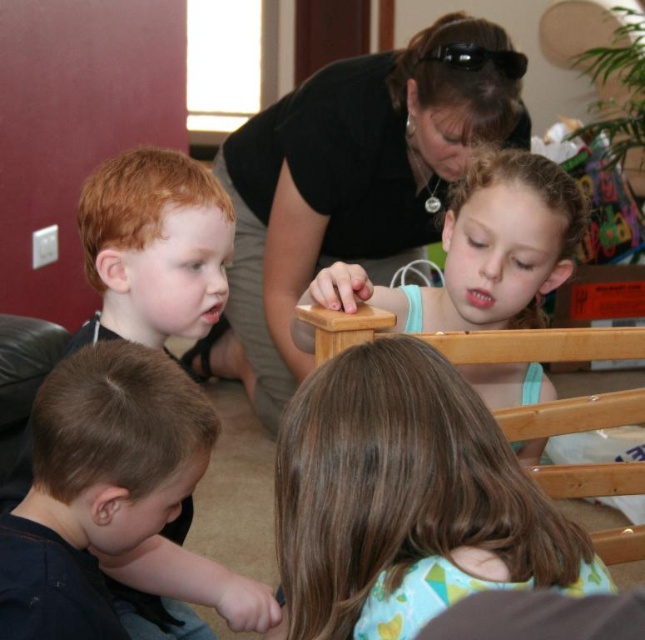
How far apart are black matte shirt at upper center and light blue fabric shirt at upper right?

30.20 inches

The height and width of the screenshot is (640, 645). I want to click on black matte shirt at upper center, so click(x=350, y=184).

Is point (393, 80) in front of point (497, 321)?

No, it is not.

Where is `black matte shirt at upper center`? black matte shirt at upper center is located at coordinates (350, 184).

Between brown smooth shirt at lower left and light blue fabric shirt at upper right, which one is positioned lower?

brown smooth shirt at lower left is lower down.

Between brown smooth shirt at lower left and light blue fabric shirt at upper right, which one has less height?

brown smooth shirt at lower left

Who is more forward, (75, 493) or (562, 244)?

Point (75, 493) is in front.

I want to click on brown smooth shirt at lower left, so click(x=132, y=468).

Is point (306, 152) closer to viewer compared to point (64, 433)?

No, it is behind (64, 433).

Is point (373, 109) positioned after point (166, 422)?

Yes.

Measure the distance between point (359, 196) and camera.

Point (359, 196) and camera are 2.15 meters apart.

I want to click on black matte shirt at upper center, so click(x=350, y=184).